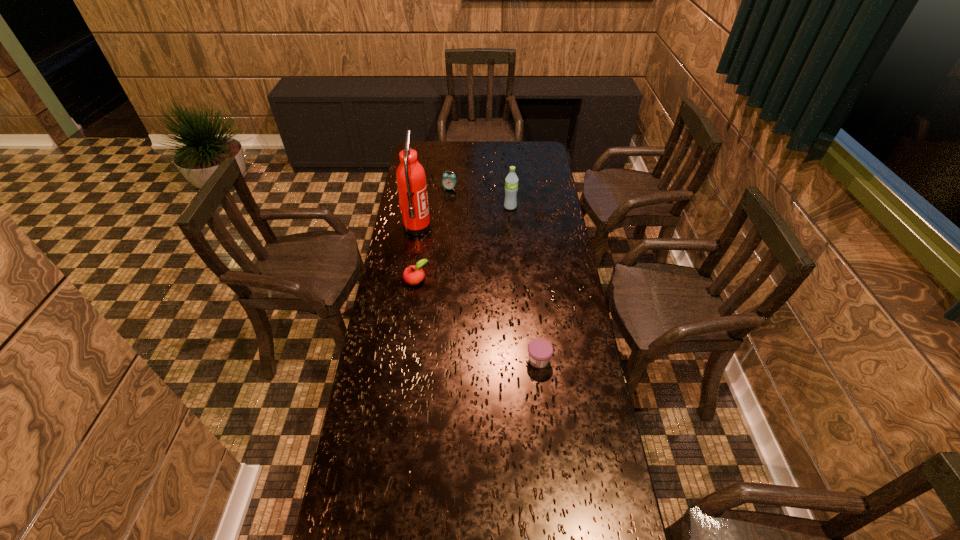
At what (x,y) coordinates should I click in order to perform the action: click on the third farthest object. Please return your answer as a coordinate pair (x, y). The height and width of the screenshot is (540, 960). Looking at the image, I should click on pos(411,180).

What are the coordinates of `fire extinguisher` in the screenshot? It's located at (411, 180).

This screenshot has height=540, width=960. In order to click on the fifth shortest object in this screenshot , I will do `click(511, 181)`.

Locate an element on the screen. the second farthest object is located at coordinates click(x=511, y=181).

The image size is (960, 540). In order to click on the farthest object in this screenshot , I will do `click(449, 181)`.

Locate an element on the screen. Image resolution: width=960 pixels, height=540 pixels. the third tallest object is located at coordinates (449, 181).

Find the location of a particular element. Image resolution: width=960 pixels, height=540 pixels. apple is located at coordinates (414, 274).

At what (x,y) coordinates should I click in order to perform the action: click on jam. Please return your answer as a coordinate pair (x, y). Looking at the image, I should click on (540, 351).

Find the location of `free space located on the label side of the fire extinguisher`. free space located on the label side of the fire extinguisher is located at coordinates (507, 228).

Find the location of a particular element. vacant point located 0.050m on the back of the second farthest object is located at coordinates [x=510, y=197].